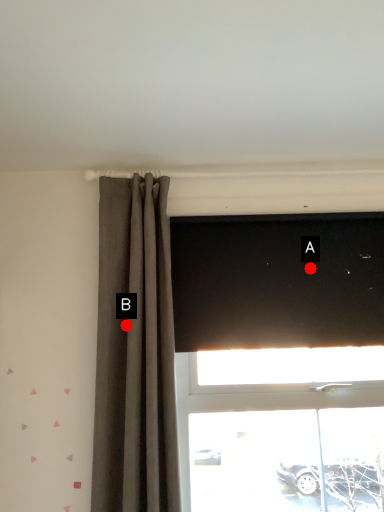
Question: Two points are circled on the image, labeled by A and B beside each circle. Which point is farther to the camera?

Choices:
 (A) A is further
 (B) B is further

Answer: (A)